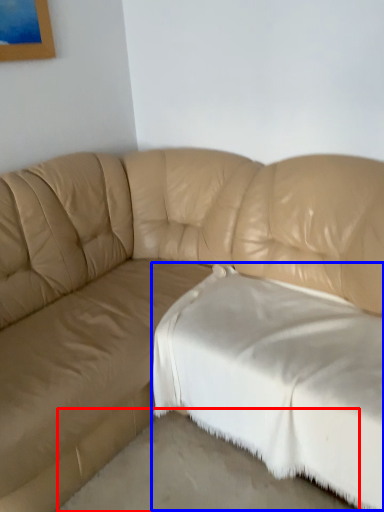
Question: Which object is closer to the camera taking this photo, concrete (highlighted by a red box) or sheet (highlighted by a blue box)?

Choices:
 (A) concrete
 (B) sheet

Answer: (A)